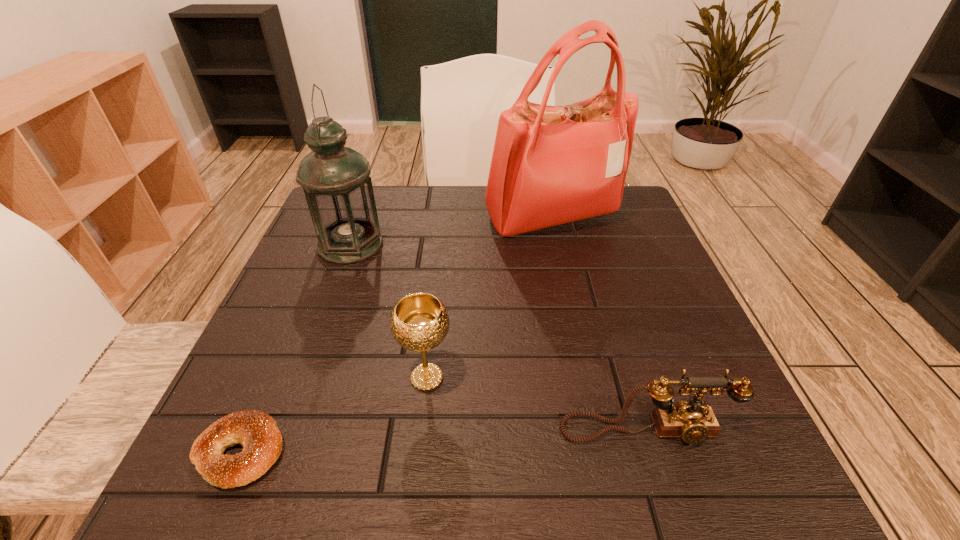
Where is `object that is at the near left corner`? This screenshot has width=960, height=540. object that is at the near left corner is located at coordinates (257, 432).

At what (x,y) coordinates should I click in order to perform the action: click on object at the far right corner. Please return your answer as a coordinate pair (x, y). Looking at the image, I should click on (551, 165).

Image resolution: width=960 pixels, height=540 pixels. In order to click on object that is positioned at the near right corner in this screenshot , I will do `click(693, 422)`.

In order to click on free spot at the far edge of the desktop in this screenshot , I will do `click(479, 212)`.

Image resolution: width=960 pixels, height=540 pixels. In the image, there is a desktop. What are the coordinates of `vacant region at the near edge` in the screenshot? It's located at (449, 458).

The width and height of the screenshot is (960, 540). What are the coordinates of `vacant space at the left edge` in the screenshot? It's located at (334, 377).

Where is `vacant space at the right edge of the desktop`? The height and width of the screenshot is (540, 960). vacant space at the right edge of the desktop is located at coordinates (640, 302).

In the image, there is a desktop. Identify the location of free space at the far right corner. (609, 230).

Locate an element on the screen. Image resolution: width=960 pixels, height=540 pixels. free space at the near right corner is located at coordinates (692, 497).

Locate an element on the screen. The image size is (960, 540). vacant area that lies between the fourth tallest object and the oil lamp is located at coordinates (498, 338).